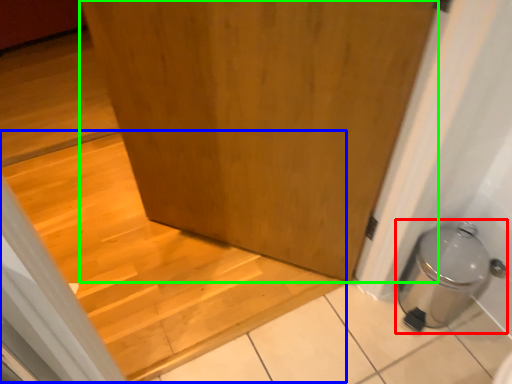
Question: Which object is positioned farthest from water heater (highlighted by a red box)? Select from stairwell (highlighted by a blue box) and door (highlighted by a green box).

Choices:
 (A) stairwell
 (B) door

Answer: (A)